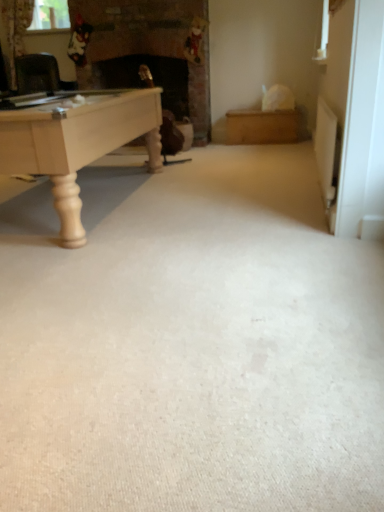
Question: From their relative heights in the image, would you say beige carpet at center is taller or shorter than clear glass window screen at upper left?

Choices:
 (A) short
 (B) tall

Answer: (A)

Question: From the image's perspective, relative to clear glass window screen at upper left, is beige carpet at center above or below?

Choices:
 (A) below
 (B) above

Answer: (A)

Question: Considering the positions of beige carpet at center and clear glass window screen at upper left in the image, is beige carpet at center bigger or smaller than clear glass window screen at upper left?

Choices:
 (A) big
 (B) small

Answer: (A)

Question: In the image, is clear glass window screen at upper left on the left side or the right side of beige carpet at center?

Choices:
 (A) left
 (B) right

Answer: (A)

Question: From a real-world perspective, is clear glass window screen at upper left above or below beige carpet at center?

Choices:
 (A) above
 (B) below

Answer: (A)

Question: In terms of size, does clear glass window screen at upper left appear bigger or smaller than beige carpet at center?

Choices:
 (A) small
 (B) big

Answer: (A)

Question: In terms of height, does clear glass window screen at upper left look taller or shorter compared to beige carpet at center?

Choices:
 (A) tall
 (B) short

Answer: (A)